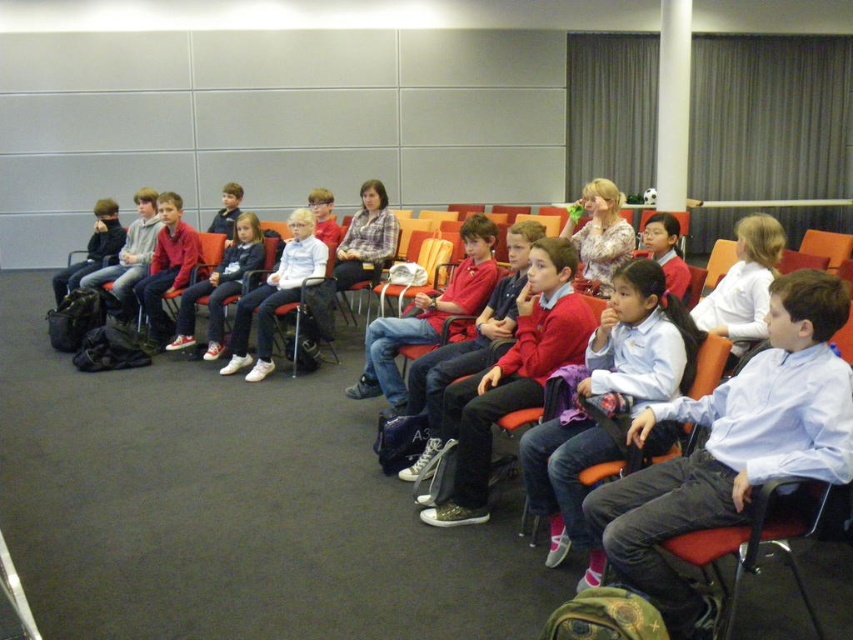
You are organizing a clothing donation drive and need to categorize items by size. You have two red garments in front of you, the matte red sweater at center and the matte red jacket at center. Which one is smaller in size?

The matte red sweater at center is smaller in size compared to the matte red jacket at center.

You are standing at the point labeled point (641, 364) and want to walk to the column near the back right corner of the room. The room has a dark gray carpet floor. What is the minimum distance you need to walk to reach the column?

The minimum distance you need to walk to reach the column near the back right corner from the point labeled point (641, 364) is 2.58 meters.

Looking at this image, you are a photographer setting up for a group photo in the room. You notice two red items at the center of the scene. Which one is taller between the matte red sweater at center and the matte red jacket at center?

The matte red sweater at center is taller than the matte red jacket at center.